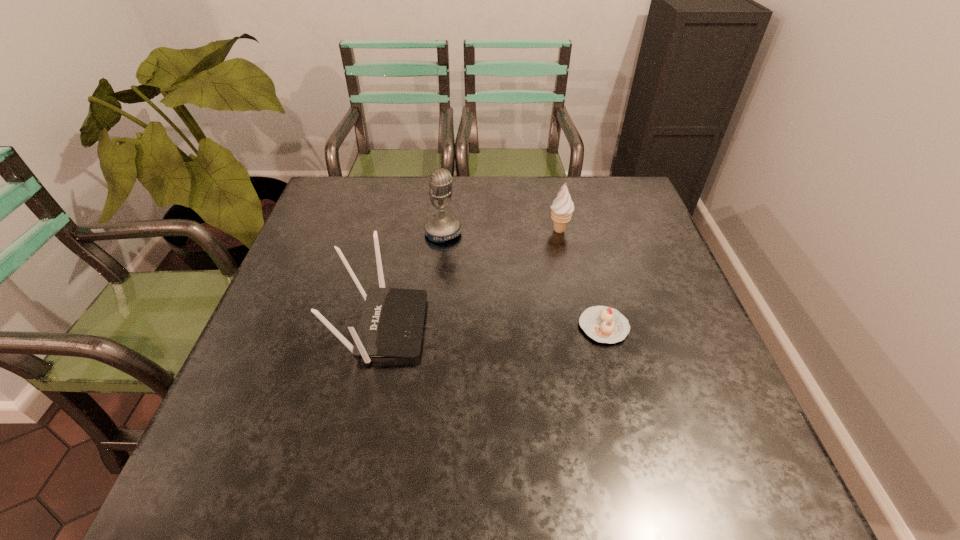
Where is `free space in the image that satisfies the following two spatial constraints: 1. on the front side of the shortest object; 2. on the left side of the icecream`? free space in the image that satisfies the following two spatial constraints: 1. on the front side of the shortest object; 2. on the left side of the icecream is located at coordinates (579, 327).